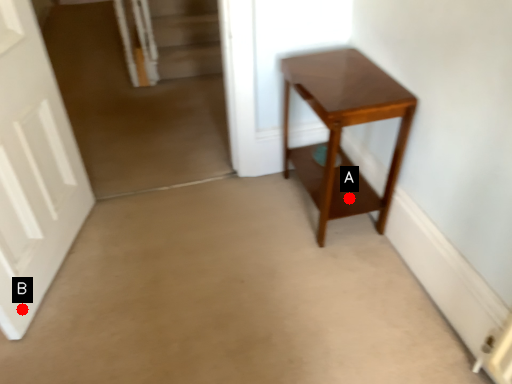
Question: Two points are circled on the image, labeled by A and B beside each circle. Which point is closer to the camera taking this photo?

Choices:
 (A) A is closer
 (B) B is closer

Answer: (B)